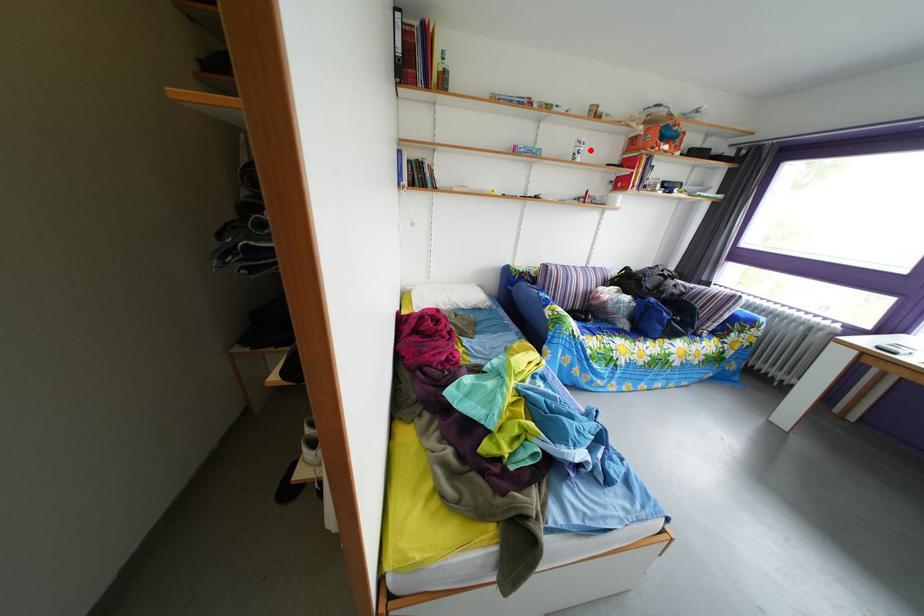
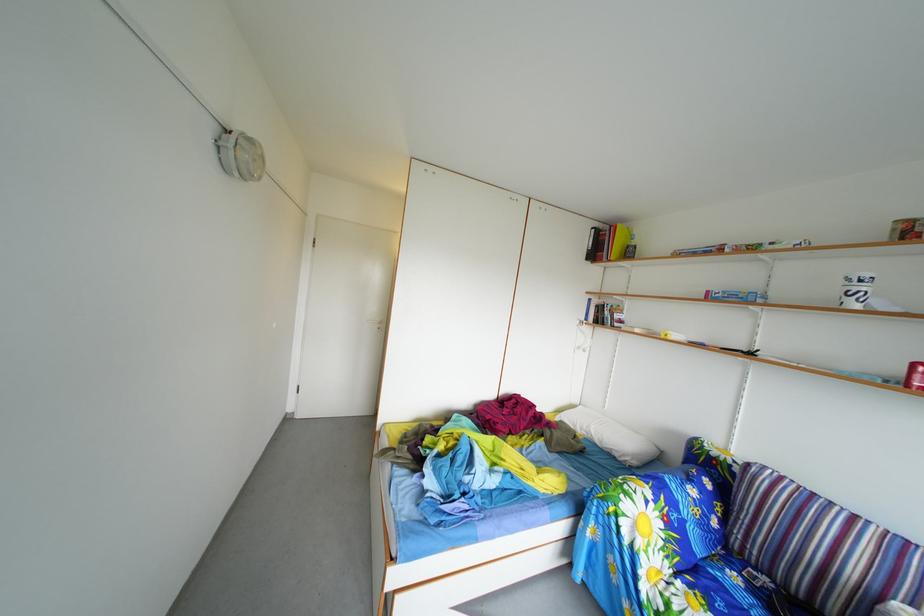
Find the pixel in the second image that matches the highlighted location in the first image.

(859, 288)